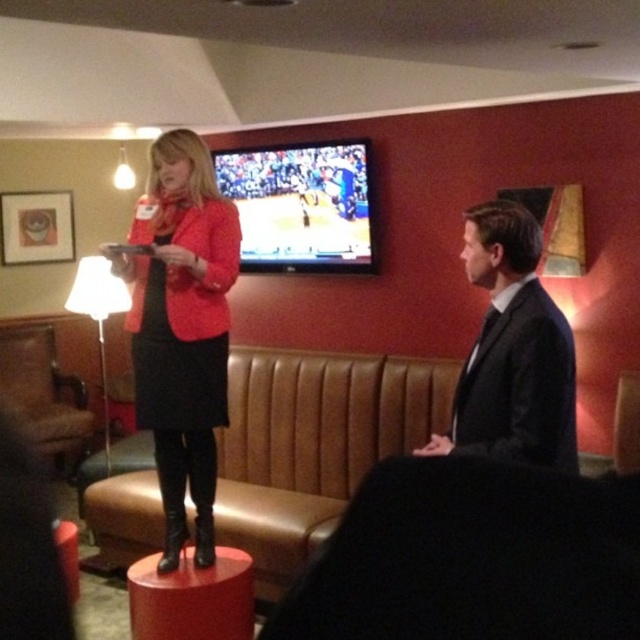
Who is more forward, (170, 486) or (164, 636)?

Point (164, 636)

Between point (221, 244) and point (240, 560), which one is positioned behind?

Point (240, 560)

Where is `matte red blazer at center`? matte red blazer at center is located at coordinates pos(180,328).

Find the location of a particular element. This screenshot has height=640, width=640. matte red blazer at center is located at coordinates (180, 328).

Looking at this image, does matte red blazer at center have a larger size compared to brown leather armchair at left?

Incorrect, matte red blazer at center is not larger than brown leather armchair at left.

Is point (192, 400) closer to camera compared to point (38, 387)?

That is True.

At what (x,y) coordinates should I click in order to perform the action: click on matte red blazer at center. Please return your answer as a coordinate pair (x, y). Looking at the image, I should click on (180, 328).

This screenshot has height=640, width=640. What do you see at coordinates (180, 328) in the screenshot? I see `matte red blazer at center` at bounding box center [180, 328].

Between matte red blazer at center and black suit at center, which one has more height?

With more height is matte red blazer at center.

The width and height of the screenshot is (640, 640). Describe the element at coordinates (180, 328) in the screenshot. I see `matte red blazer at center` at that location.

Image resolution: width=640 pixels, height=640 pixels. In order to click on matte red blazer at center in this screenshot , I will do `click(180, 328)`.